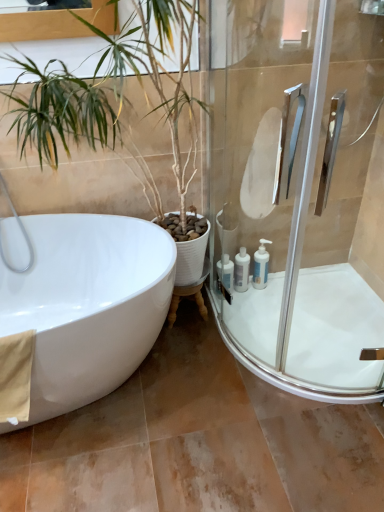
Question: From the image's perspective, would you say white glossy bathtub at left is positioned over white plastic bottles at lower right, positioned as the 1th toiletry in left-to-right order?

Choices:
 (A) yes
 (B) no

Answer: (B)

Question: Does white glossy bathtub at left appear on the left side of white plastic bottles at lower right, the 3th toiletry viewed from the right?

Choices:
 (A) no
 (B) yes

Answer: (B)

Question: Considering the relative sizes of white glossy bathtub at left and white plastic bottles at lower right, positioned as the 1th toiletry in left-to-right order, in the image provided, is white glossy bathtub at left thinner than white plastic bottles at lower right, positioned as the 1th toiletry in left-to-right order,?

Choices:
 (A) yes
 (B) no

Answer: (B)

Question: From a real-world perspective, is white glossy bathtub at left below white plastic bottles at lower right, positioned as the 1th toiletry in left-to-right order?

Choices:
 (A) no
 (B) yes

Answer: (A)

Question: Is white plastic bottles at lower right, positioned as the 1th toiletry in left-to-right order, located within white glossy bathtub at left?

Choices:
 (A) no
 (B) yes

Answer: (A)

Question: Considering the positions of clear glass shower door at right and white glossy bath at lower right in the image, is clear glass shower door at right wider or thinner than white glossy bath at lower right?

Choices:
 (A) thin
 (B) wide

Answer: (A)

Question: Based on their sizes in the image, would you say clear glass shower door at right is bigger or smaller than white glossy bath at lower right?

Choices:
 (A) big
 (B) small

Answer: (A)

Question: Which is correct: clear glass shower door at right is inside white glossy bath at lower right, or outside of it?

Choices:
 (A) outside
 (B) inside

Answer: (A)

Question: Considering the positions of point (329, 250) and point (292, 331), is point (329, 250) closer or farther from the camera than point (292, 331)?

Choices:
 (A) farther
 (B) closer

Answer: (A)

Question: Is point (382, 360) positioned closer to the camera than point (221, 266)?

Choices:
 (A) farther
 (B) closer

Answer: (B)

Question: Relative to white plastic bottles at lower right, positioned as the 1th toiletry in left-to-right order, is white glossy bath at lower right in front or behind?

Choices:
 (A) front
 (B) behind

Answer: (A)

Question: Looking at their shapes, would you say white glossy bath at lower right is wider or thinner than white plastic bottles at lower right, positioned as the 1th toiletry in left-to-right order?

Choices:
 (A) thin
 (B) wide

Answer: (B)

Question: From the image's perspective, is white glossy bath at lower right located above or below white plastic bottles at lower right, positioned as the 1th toiletry in left-to-right order?

Choices:
 (A) below
 (B) above

Answer: (A)

Question: Is white plastic bottles at right, positioned as the third toiletry in left-to-right order, to the left or to the right of green leafy plant at left in the image?

Choices:
 (A) right
 (B) left

Answer: (A)

Question: Is white plastic bottles at right, marked as the first toiletry in a right-to-left arrangement, bigger or smaller than green leafy plant at left?

Choices:
 (A) big
 (B) small

Answer: (B)